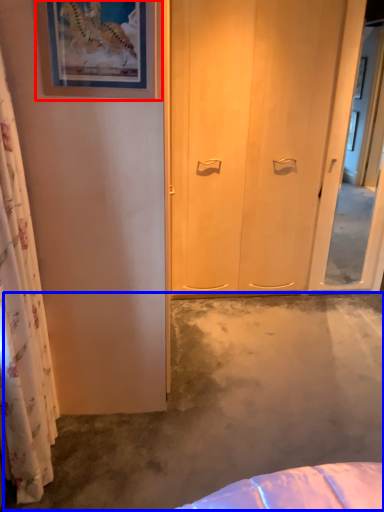
Question: Among these objects, which one is farthest to the camera, picture frame (highlighted by a red box) or concrete (highlighted by a blue box)?

Choices:
 (A) picture frame
 (B) concrete

Answer: (B)